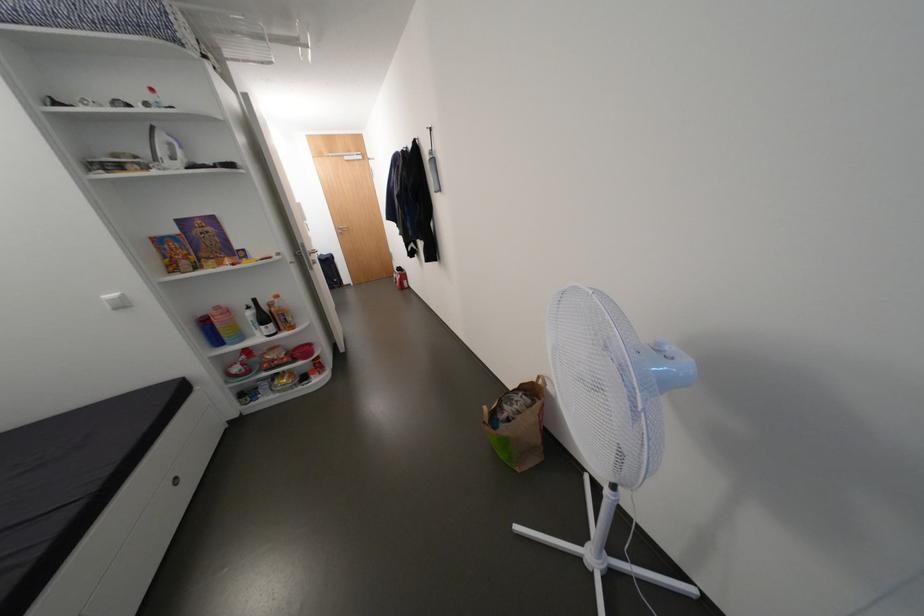
At what (x,y) coordinates should I click in order to perform the action: click on black iron handle. Please return your answer as a coordinate pair (x, y). Image resolution: width=924 pixels, height=616 pixels. Looking at the image, I should click on (617, 467).